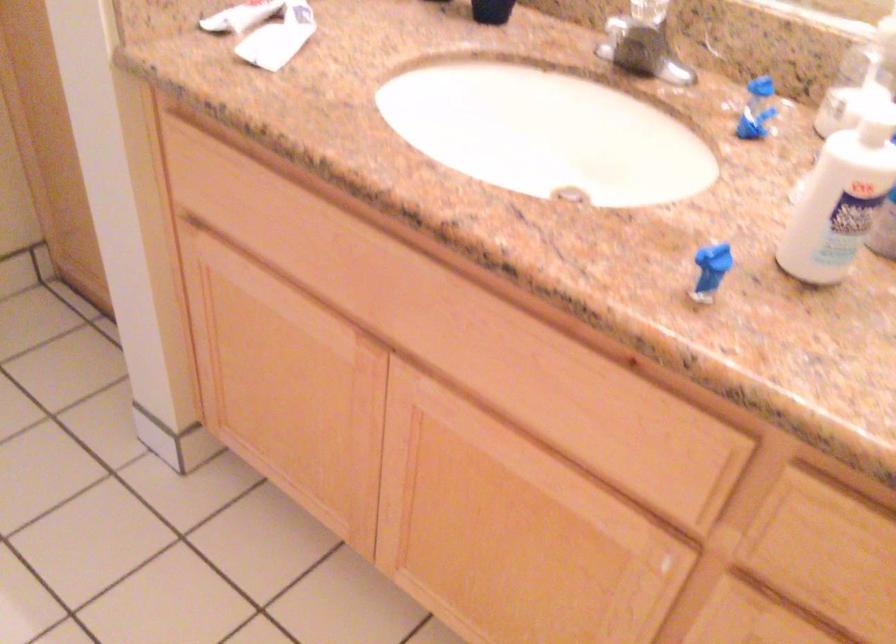
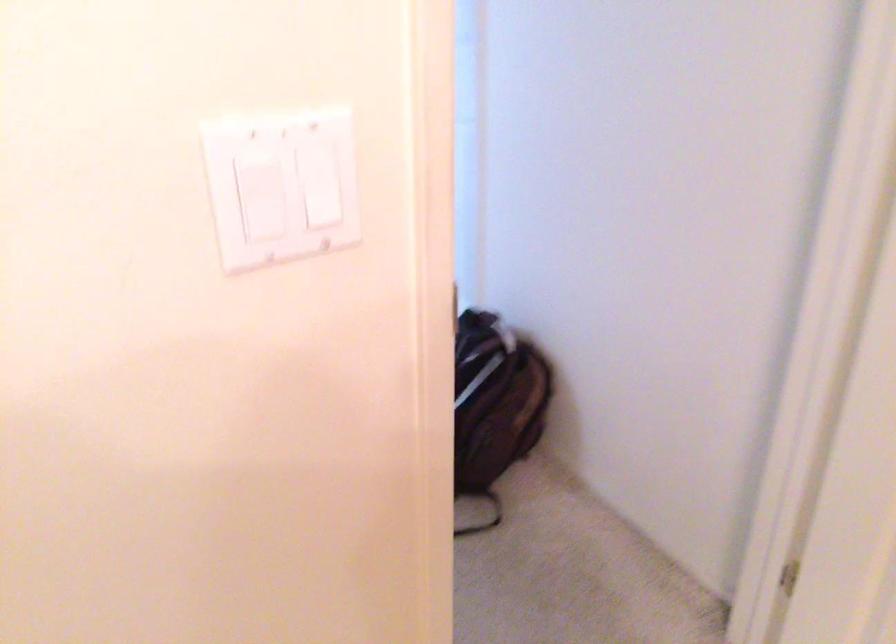
First-person continuous shooting, in which direction is the camera rotating?

The camera rotated toward left-down.